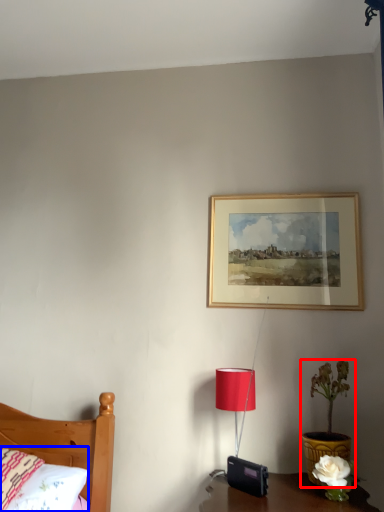
Question: Among these objects, which one is farthest to the camera, houseplant (highlighted by a red box) or pillow (highlighted by a blue box)?

Choices:
 (A) houseplant
 (B) pillow

Answer: (A)